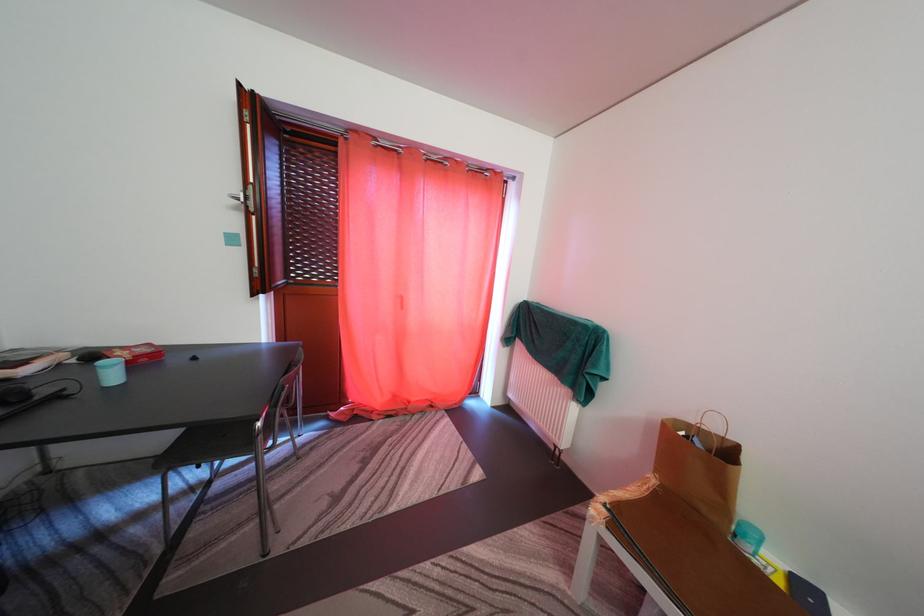
The location [111,371] corresponds to which object?

It corresponds to the small blue container in the image.